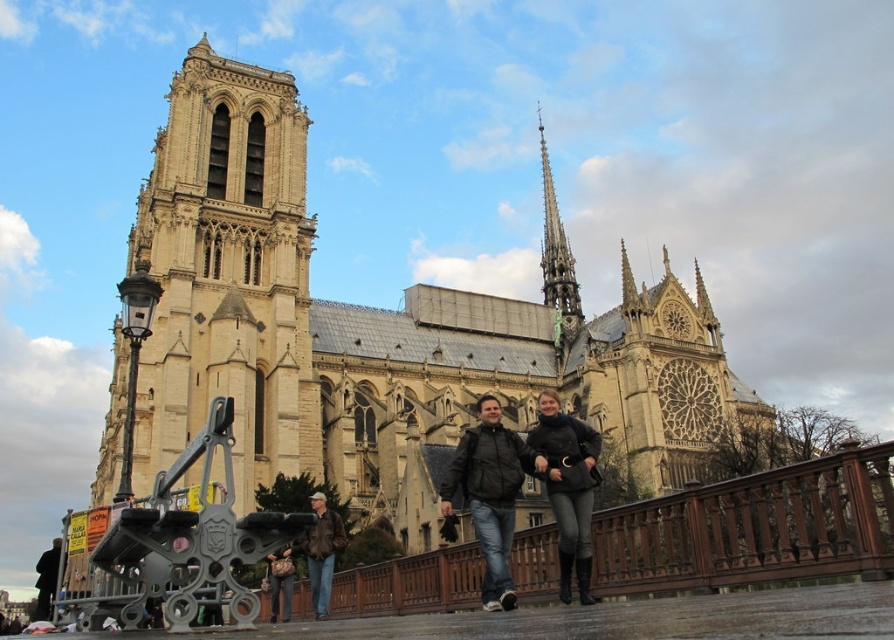
Based on the coordinates provided, which object in the scene is located at point [226,273]?

The beige stone tower at left is located at point [226,273].